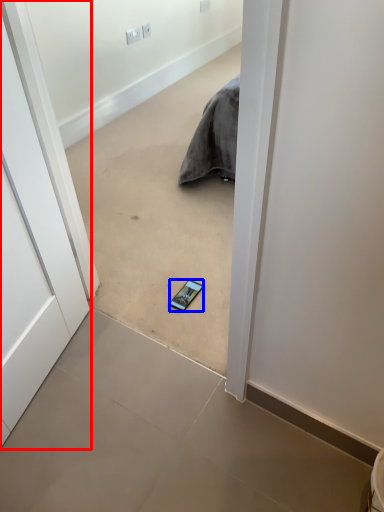
Question: Which object is further to the camera taking this photo, door (highlighted by a red box) or smartphone (highlighted by a blue box)?

Choices:
 (A) door
 (B) smartphone

Answer: (B)